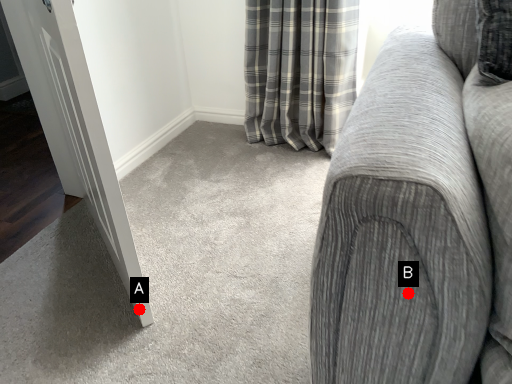
Question: Two points are circled on the image, labeled by A and B beside each circle. Which point appears closest to the camera in this image?

Choices:
 (A) A is closer
 (B) B is closer

Answer: (B)